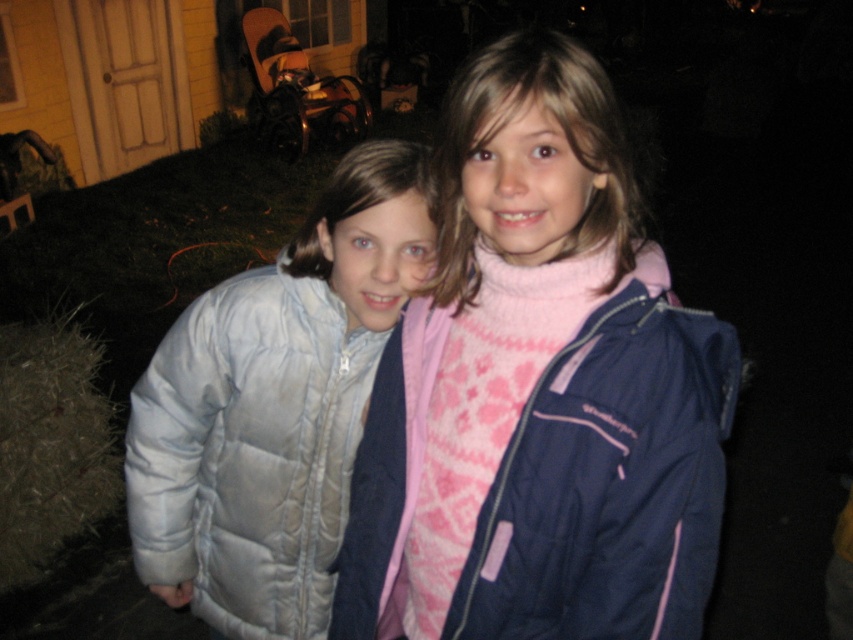
Question: Does pink quilted jacket at center appear on the left side of light gray quilted jacket at left?

Choices:
 (A) yes
 (B) no

Answer: (B)

Question: Which point appears closest to the camera in this image?

Choices:
 (A) (222, 468)
 (B) (426, 435)

Answer: (B)

Question: Considering the relative positions of pink quilted jacket at center and light gray quilted jacket at left in the image provided, where is pink quilted jacket at center located with respect to light gray quilted jacket at left?

Choices:
 (A) right
 (B) left

Answer: (A)

Question: Can you confirm if pink quilted jacket at center is positioned above light gray quilted jacket at left?

Choices:
 (A) no
 (B) yes

Answer: (B)

Question: Which point is farther to the camera?

Choices:
 (A) (161, 406)
 (B) (654, 330)

Answer: (A)